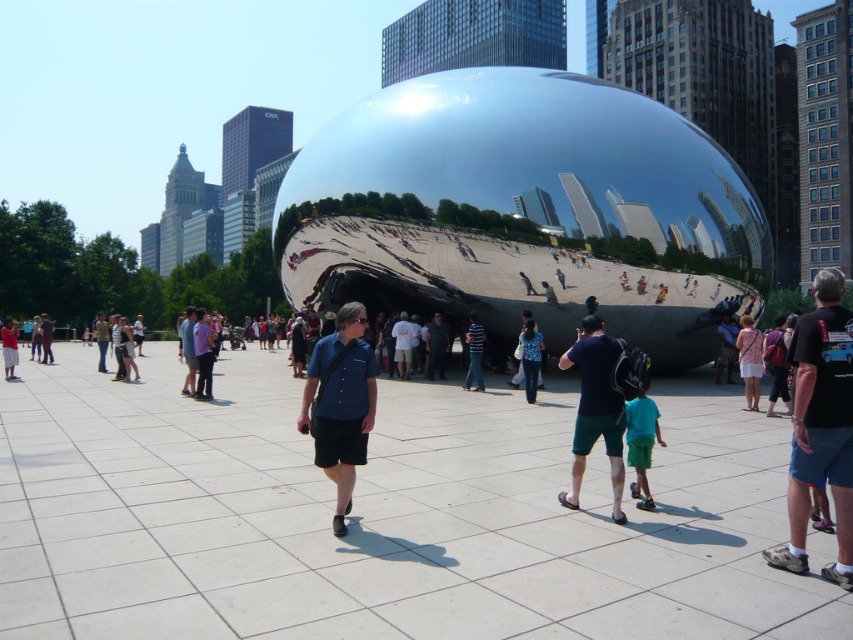
Question: Does denim pants at center appear under matte black shorts at lower left?

Choices:
 (A) no
 (B) yes

Answer: (B)

Question: Does blue fabric shirt at center have a larger size compared to striped shirt at center?

Choices:
 (A) yes
 (B) no

Answer: (A)

Question: Which of the following is the closest to the observer?

Choices:
 (A) (9, 365)
 (B) (585, 451)
 (C) (840, 316)

Answer: (C)

Question: Estimate the real-world distances between objects in this image. Which object is closer to the blue fabric shirt at center?

Choices:
 (A) denim pants at center
 (B) matte black shorts at lower left
 (C) dark blue shirt at center
 (D) striped shirt at center

Answer: (C)

Question: Is black cotton shirt at right bigger than matte black shorts at lower left?

Choices:
 (A) yes
 (B) no

Answer: (B)

Question: Which object is closer to the camera taking this photo?

Choices:
 (A) blue fabric shirt at center
 (B) green shorts at center
 (C) striped shirt at center

Answer: (A)